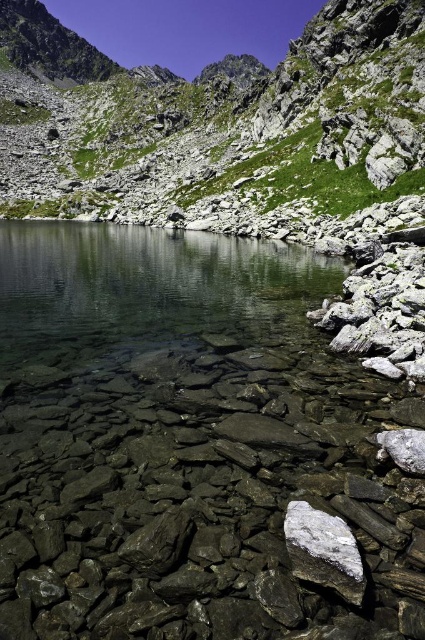
Question: Which point is closer to the camera?

Choices:
 (A) (235, 317)
 (B) (186, 289)
 (C) (306, 547)
 (D) (217, 102)

Answer: (C)

Question: Among these objects, which one is farthest from the camera?

Choices:
 (A) clear stone water at center
 (B) white crystalline rock at center

Answer: (B)

Question: Is green grassy hillside at upper center smaller than white crystalline rock at center?

Choices:
 (A) no
 (B) yes

Answer: (A)

Question: In this image, where is clear stone water at center located relative to green grassy hillside at upper center?

Choices:
 (A) above
 (B) below

Answer: (B)

Question: Considering the real-world distances, which object is closest to the clear stone water at center?

Choices:
 (A) green grassy hillside at upper center
 (B) white crystalline rock at center
 (C) clear glass water at center

Answer: (B)

Question: Is clear glass water at center bigger than white crystalline rock at center?

Choices:
 (A) no
 (B) yes

Answer: (B)